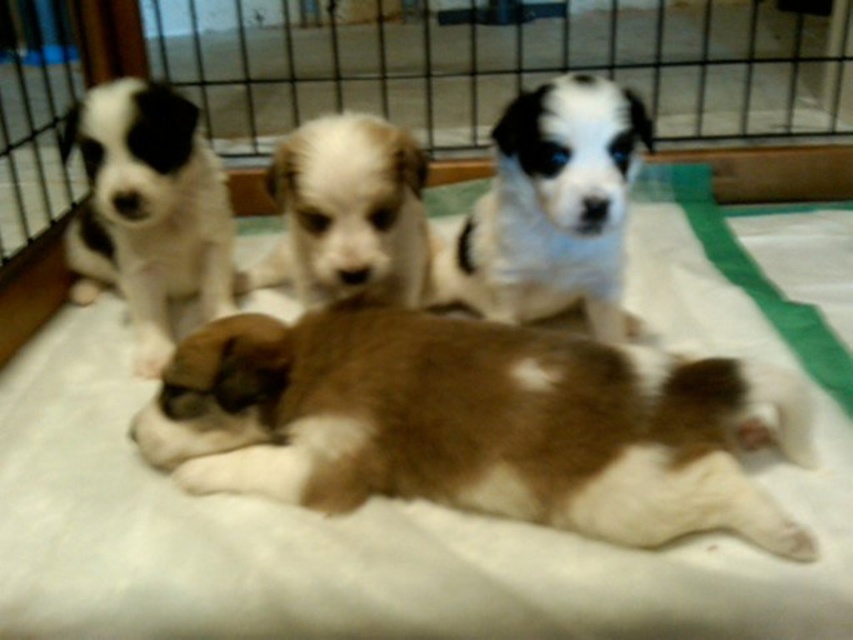
You are a photographer standing in front of the playpen. You want to take a closeup of the puppy at point [538,52] without the other puppy at point [337,220] appearing in the frame. Based on their positions, is this possible?

Yes, because point [538,52] is closer to you than point [337,220]. By focusing on the closer puppy, you can blur the background, making the other puppy less visible or out of focus.

You are a pet owner who wants to place a new toy between the white fluffy dog bed at center and the white fur puppy at left. The toy requires a minimum of 10 inches of space to be placed safely. Based on the scene, can you determine if there is enough space between them?

The white fluffy dog bed at center is 12.92 inches from the white fur puppy at left. Since the required space is 10 inches, there is enough space to place the toy safely between them.